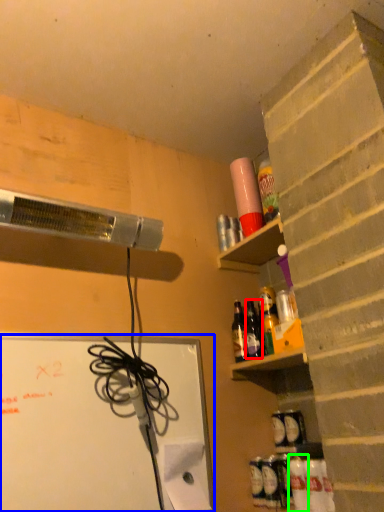
Question: Based on their relative distances, which object is farther from bottle (highlighted by a red box)? Choose from bulletin board (highlighted by a blue box) and bottle (highlighted by a green box).

Choices:
 (A) bulletin board
 (B) bottle

Answer: (A)